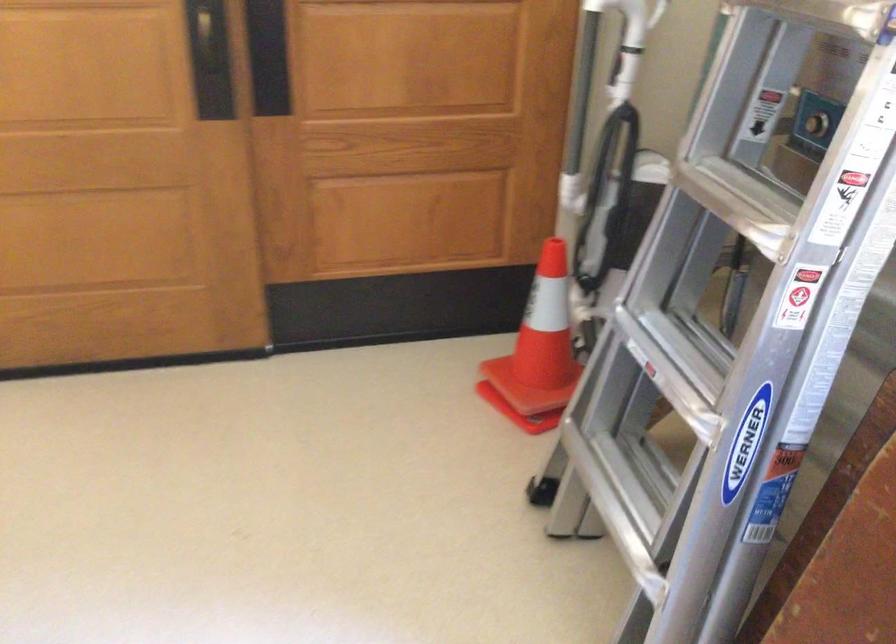
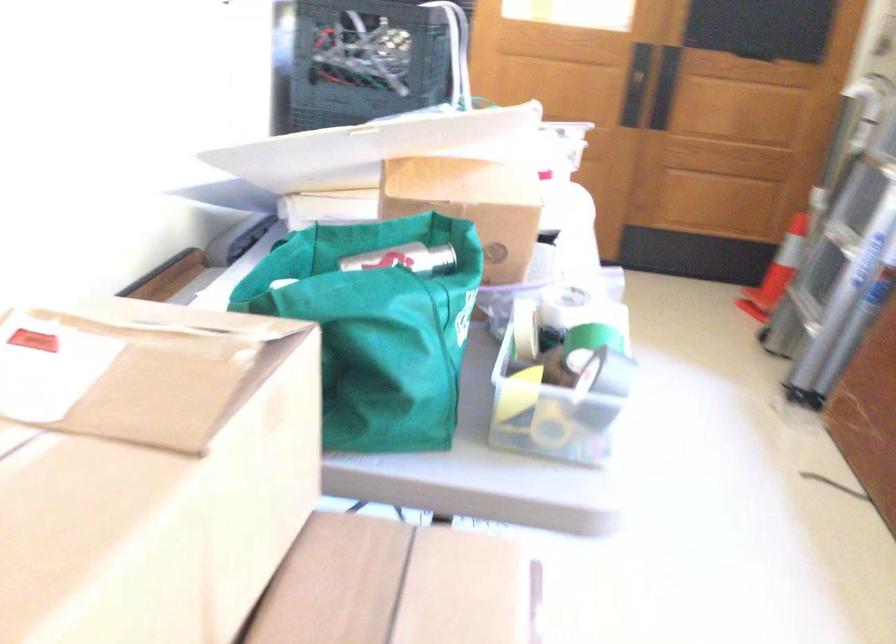
In the second image, find the point that corresponds to pixel 496 375 in the first image.

(777, 272)